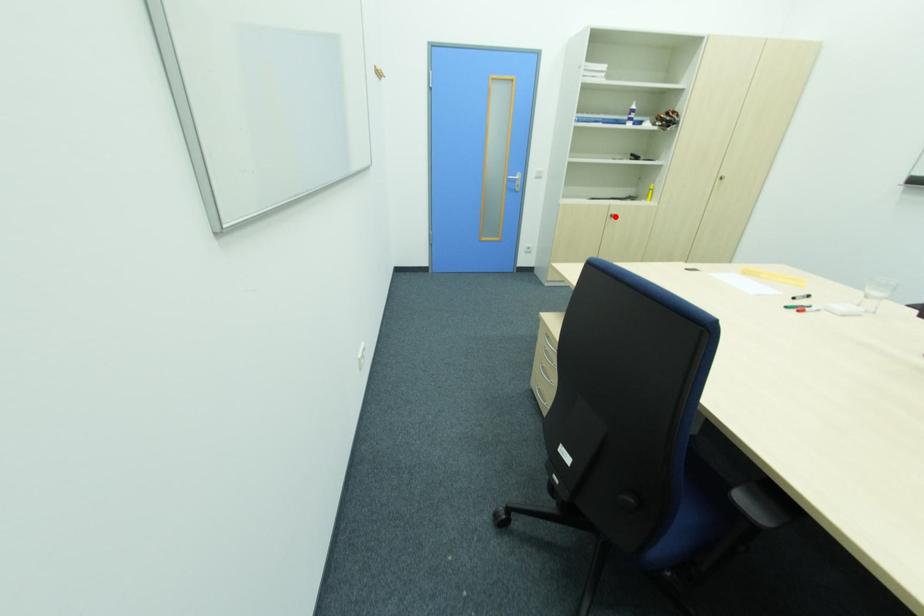
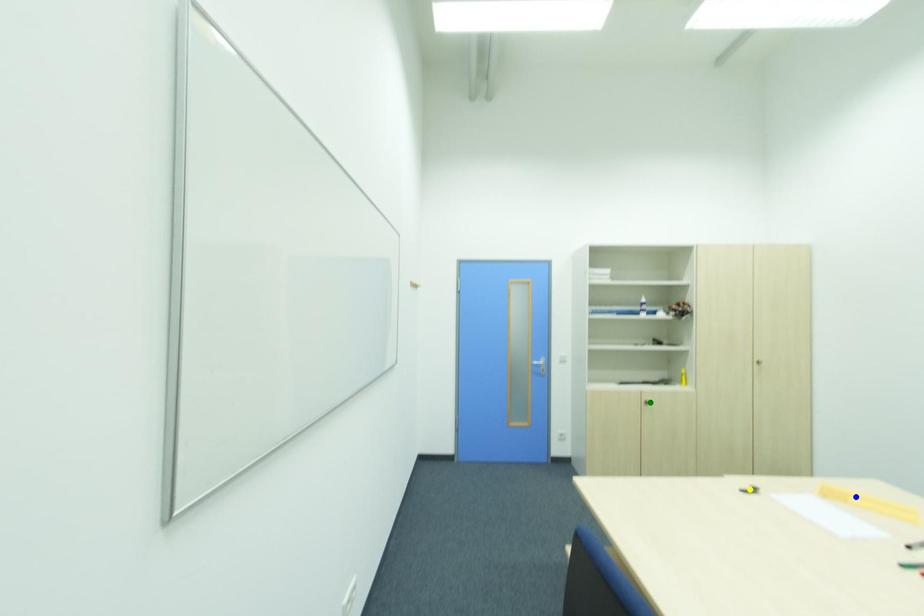
Question: I am providing you with two images of the same scene from different viewpoints. A red point is marked on the first image. You are given multiple points on the second image. Which spot in image 2 lines up with the point in image 1?

Choices:
 (A) yellow point
 (B) green point
 (C) blue point

Answer: (B)